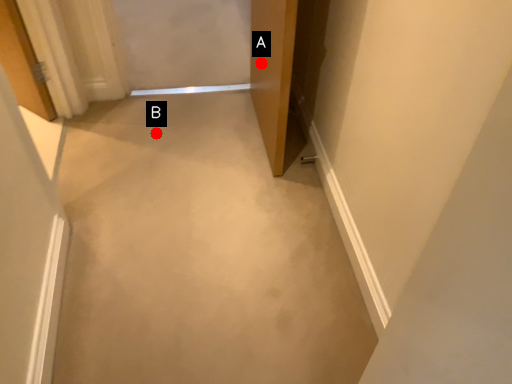
Question: Two points are circled on the image, labeled by A and B beside each circle. Among these points, which one is farthest from the camera?

Choices:
 (A) A is further
 (B) B is further

Answer: (B)